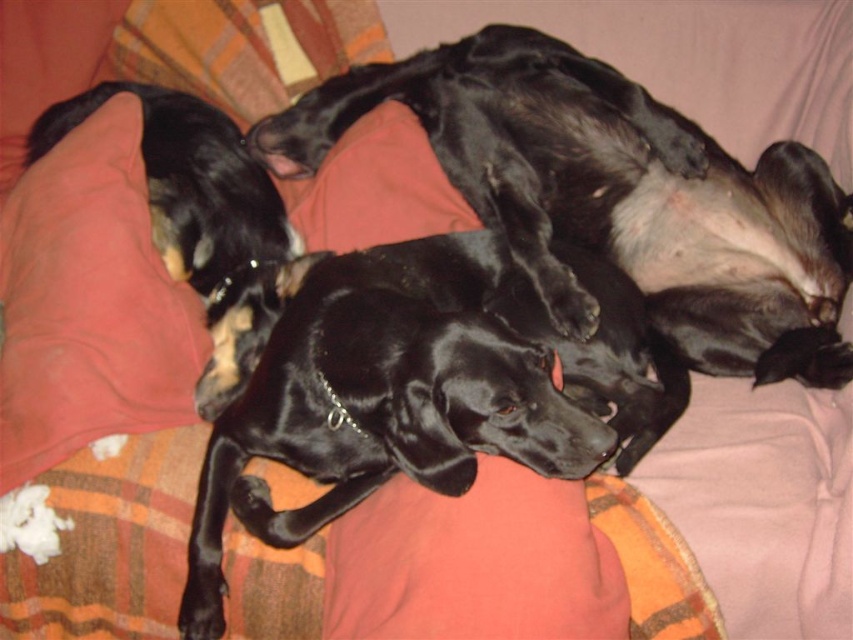
You are a delivery robot with a package that is 2 meters long. You need to place it between the two points marked as point (306, 150) and another point. Is there enough space to place the package between them?

The distance between the two points marked as point (306, 150) and the other point is 1.56 meters. Since the package is 2 meters long, it won not fit between them.

You are a dog owner who wants to place a new toy between the black shiny dog at center and the cotton pillow at left. Is there enough space to fit a toy that is 20 inches long?

The distance between the black shiny dog at center and the cotton pillow at left is 21.07 inches. Since the toy is 20 inches long, there is enough space to place it between them.

Based on the photo, you are a dog owner who wants to place a new toy between the black shiny dog at center and the cotton pillow at left. Based on their positions, which object is closer to you so you can place the toy in front of it?

The black shiny dog at center is closer to you than the cotton pillow at left, so you should place the toy in front of the black shiny dog at center.